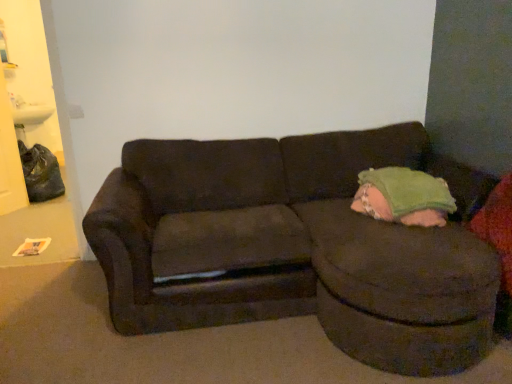
In order to face dark brown fabric studio couch at center, should I rotate leftwards or rightwards?

To align with it, rotate right about 6.522°.

Identify the location of dark brown fabric studio couch at center. The height and width of the screenshot is (384, 512). (296, 246).

The image size is (512, 384). Describe the element at coordinates (296, 246) in the screenshot. I see `dark brown fabric studio couch at center` at that location.

Based on the photo, measure the distance between point (237, 289) and camera.

The distance of point (237, 289) from camera is 2.21 meters.

Consider the image. Measure the distance between point (456, 207) and camera.

They are 7.69 feet apart.

This screenshot has width=512, height=384. What do you see at coordinates (403, 197) in the screenshot?
I see `soft pink blanket at right` at bounding box center [403, 197].

Locate an element on the screen. Image resolution: width=512 pixels, height=384 pixels. soft pink blanket at right is located at coordinates (403, 197).

Where is `dark brown fabric studio couch at center`? The height and width of the screenshot is (384, 512). dark brown fabric studio couch at center is located at coordinates (296, 246).

Consider the image. Does dark brown fabric studio couch at center appear on the right side of soft pink blanket at right?

Incorrect, dark brown fabric studio couch at center is not on the right side of soft pink blanket at right.

Which object is further away from the camera taking this photo, dark brown fabric studio couch at center or soft pink blanket at right?

soft pink blanket at right is more distant.

Is point (239, 169) closer or farther from the camera than point (383, 176)?

Clearly, point (239, 169) is more distant from the camera than point (383, 176).

From the image's perspective, which one is positioned lower, dark brown fabric studio couch at center or soft pink blanket at right?

dark brown fabric studio couch at center, from the image's perspective.

From a real-world perspective, is dark brown fabric studio couch at center physically above soft pink blanket at right?

No, from a real-world perspective, dark brown fabric studio couch at center is not over soft pink blanket at right

Is dark brown fabric studio couch at center thinner than soft pink blanket at right?

In fact, dark brown fabric studio couch at center might be wider than soft pink blanket at right.

Considering the sizes of dark brown fabric studio couch at center and soft pink blanket at right in the image, is dark brown fabric studio couch at center taller or shorter than soft pink blanket at right?

Considering their sizes, dark brown fabric studio couch at center has more height than soft pink blanket at right.

Considering the relative sizes of dark brown fabric studio couch at center and soft pink blanket at right in the image provided, is dark brown fabric studio couch at center bigger than soft pink blanket at right?

Yes.

Is dark brown fabric studio couch at center inside the boundaries of soft pink blanket at right, or outside?

The correct answer is: outside.

Is dark brown fabric studio couch at center positioned far away from soft pink blanket at right?

No.

Is soft pink blanket at right at the back of dark brown fabric studio couch at center?

Correct, dark brown fabric studio couch at center is looking away from soft pink blanket at right.

How far apart are dark brown fabric studio couch at center and soft pink blanket at right?

44.84 centimeters.

You are a GUI agent. You are given a task and a screenshot of the screen. Output one action in this format:
    pyautogui.click(x=<x>, y=<y>)
    Task: Click on the studio couch in front of the soft pink blanket at right
    
    Given the screenshot: What is the action you would take?
    pyautogui.click(x=296, y=246)

Does soft pink blanket at right appear on the left side of dark brown fabric studio couch at center?

No.

Consider the image. Considering their positions, is soft pink blanket at right located in front of or behind dark brown fabric studio couch at center?

soft pink blanket at right is positioned farther from the viewer than dark brown fabric studio couch at center.

Does point (370, 197) come farther from viewer compared to point (257, 293)?

Yes.

From the image's perspective, which one is positioned higher, soft pink blanket at right or dark brown fabric studio couch at center?

soft pink blanket at right, from the image's perspective.

From a real-world perspective, is soft pink blanket at right beneath dark brown fabric studio couch at center?

No, from a real-world perspective, soft pink blanket at right is not below dark brown fabric studio couch at center.

Is soft pink blanket at right wider or thinner than dark brown fabric studio couch at center?

Considering their sizes, soft pink blanket at right looks slimmer than dark brown fabric studio couch at center.

Does soft pink blanket at right have a lesser height compared to dark brown fabric studio couch at center?

Correct, soft pink blanket at right is not as tall as dark brown fabric studio couch at center.

Considering the relative sizes of soft pink blanket at right and dark brown fabric studio couch at center in the image provided, is soft pink blanket at right smaller than dark brown fabric studio couch at center?

Correct, soft pink blanket at right occupies less space than dark brown fabric studio couch at center.

Is dark brown fabric studio couch at center completely or partially inside soft pink blanket at right?

No, dark brown fabric studio couch at center is not a part of soft pink blanket at right.

Would you say soft pink blanket at right is a long distance from dark brown fabric studio couch at center?

No, there isn't a large distance between soft pink blanket at right and dark brown fabric studio couch at center.

Does soft pink blanket at right turn towards dark brown fabric studio couch at center?

Yes, soft pink blanket at right is turned towards dark brown fabric studio couch at center.

How many degrees apart are the facing directions of soft pink blanket at right and dark brown fabric studio couch at center?

The facing directions of soft pink blanket at right and dark brown fabric studio couch at center are 2.31 degrees apart.

At what (x,y) coordinates should I click in order to perform the action: click on studio couch located underneath the soft pink blanket at right (from a real-world perspective). Please return your answer as a coordinate pair (x, y). The image size is (512, 384). Looking at the image, I should click on (296, 246).

You are a GUI agent. You are given a task and a screenshot of the screen. Output one action in this format:
    pyautogui.click(x=<x>, y=<y>)
    Task: Click on the toddler behind the dark brown fabric studio couch at center
    The height and width of the screenshot is (384, 512).
    Given the screenshot: What is the action you would take?
    [x=403, y=197]

The width and height of the screenshot is (512, 384). In order to click on studio couch below the soft pink blanket at right (from a real-world perspective) in this screenshot , I will do `click(296, 246)`.